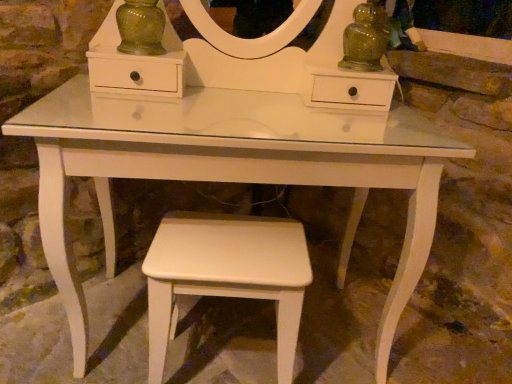
Question: Is white matte stool at lower center inside the boundaries of green glass vase at upper left, or outside?

Choices:
 (A) inside
 (B) outside

Answer: (B)

Question: From a real-world perspective, is white matte stool at lower center physically located above or below green glass vase at upper left?

Choices:
 (A) below
 (B) above

Answer: (A)

Question: In the image, is white matte stool at lower center positioned in front of or behind green glass vase at upper left?

Choices:
 (A) front
 (B) behind

Answer: (A)

Question: Considering the positions of green glass vase at upper left and white matte stool at lower center in the image, is green glass vase at upper left taller or shorter than white matte stool at lower center?

Choices:
 (A) tall
 (B) short

Answer: (B)

Question: Considering the positions of point (138, 49) and point (193, 225), is point (138, 49) closer or farther from the camera than point (193, 225)?

Choices:
 (A) farther
 (B) closer

Answer: (A)

Question: Do you think green glass vase at upper left is within white matte stool at lower center, or outside of it?

Choices:
 (A) inside
 (B) outside

Answer: (B)

Question: Looking at their shapes, would you say green glass vase at upper left is wider or thinner than white matte stool at lower center?

Choices:
 (A) wide
 (B) thin

Answer: (B)